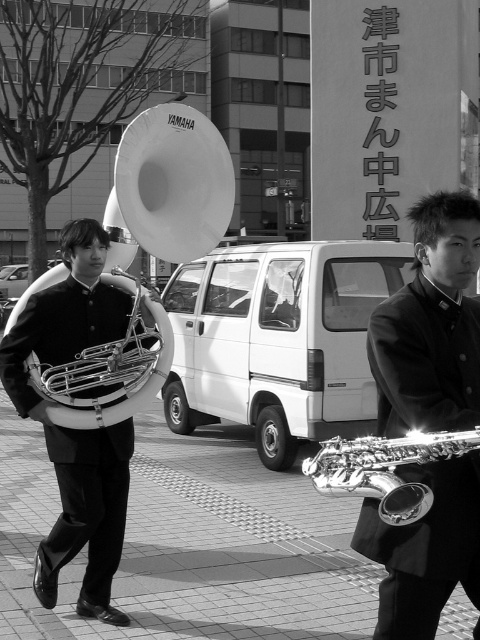
Question: Which point is closer to the camera taking this photo?

Choices:
 (A) (418, 483)
 (B) (167, 120)

Answer: (A)

Question: Based on their relative distances, which object is farther from the white plastic trumpet at center?

Choices:
 (A) shiny brass tuba at left
 (B) brick pavement at center

Answer: (B)

Question: Does white plastic trumpet at center lie behind shiny brass trumpet at center?

Choices:
 (A) yes
 (B) no

Answer: (A)

Question: Estimate the real-world distances between objects in this image. Which object is farther from the shiny silver trumpet at center?

Choices:
 (A) shiny brass tuba at left
 (B) brick pavement at center
 (C) white plastic trumpet at center
 (D) shiny brass trumpet at center

Answer: (B)

Question: Is white plastic trumpet at center thinner than shiny silver trumpet at center?

Choices:
 (A) yes
 (B) no

Answer: (B)

Question: Does brick pavement at center appear over shiny silver trumpet at center?

Choices:
 (A) no
 (B) yes

Answer: (A)